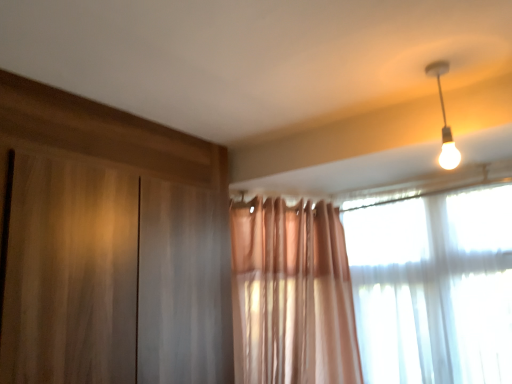
Question: In terms of size, does translucent fabric window at upper right appear bigger or smaller than white glossy bulb at upper right?

Choices:
 (A) small
 (B) big

Answer: (B)

Question: Is translucent fabric window at upper right in front of or behind white glossy bulb at upper right in the image?

Choices:
 (A) front
 (B) behind

Answer: (B)

Question: Looking at their shapes, would you say translucent fabric window at upper right is wider or thinner than white glossy bulb at upper right?

Choices:
 (A) wide
 (B) thin

Answer: (A)

Question: Looking at the image, does white glossy bulb at upper right seem bigger or smaller compared to translucent fabric window at upper right?

Choices:
 (A) small
 (B) big

Answer: (A)

Question: Choose the correct answer: Is white glossy bulb at upper right inside translucent fabric window at upper right or outside it?

Choices:
 (A) outside
 (B) inside

Answer: (A)

Question: From a real-world perspective, relative to translucent fabric window at upper right, is white glossy bulb at upper right vertically above or below?

Choices:
 (A) below
 (B) above

Answer: (B)

Question: From the image's perspective, is white glossy bulb at upper right positioned above or below translucent fabric window at upper right?

Choices:
 (A) above
 (B) below

Answer: (A)